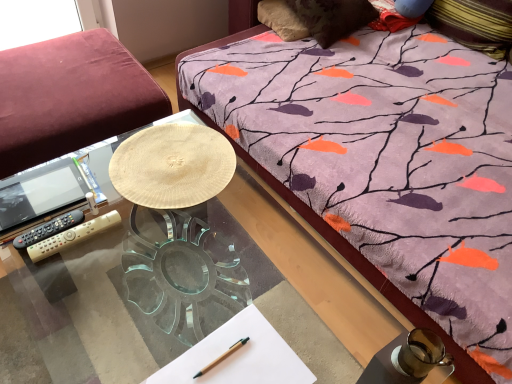
Question: Does velvet burgundy studio couch at left have a greater height compared to transparent glass desk at center?

Choices:
 (A) yes
 (B) no

Answer: (A)

Question: Are velvet burgundy studio couch at left and transparent glass desk at center far apart?

Choices:
 (A) no
 (B) yes

Answer: (A)

Question: Can you confirm if velvet burgundy studio couch at left is thinner than transparent glass desk at center?

Choices:
 (A) yes
 (B) no

Answer: (A)

Question: Considering the relative sizes of velvet burgundy studio couch at left and transparent glass desk at center in the image provided, is velvet burgundy studio couch at left shorter than transparent glass desk at center?

Choices:
 (A) yes
 (B) no

Answer: (B)

Question: Would you say velvet burgundy studio couch at left contains transparent glass desk at center?

Choices:
 (A) no
 (B) yes

Answer: (A)

Question: Relative to black plastic remote control at left, acting as the first remote control starting from the left, is wooden pen at lower center in front or behind?

Choices:
 (A) behind
 (B) front

Answer: (B)

Question: Is point (202, 372) positioned closer to the camera than point (49, 223)?

Choices:
 (A) closer
 (B) farther

Answer: (A)

Question: Looking at their shapes, would you say wooden pen at lower center is wider or thinner than black plastic remote control at left, acting as the first remote control starting from the left?

Choices:
 (A) thin
 (B) wide

Answer: (A)

Question: Looking at the image, does wooden pen at lower center seem bigger or smaller compared to black plastic remote control at left, acting as the first remote control starting from the left?

Choices:
 (A) small
 (B) big

Answer: (A)

Question: In terms of height, does transparent glass desk at center look taller or shorter compared to gold plastic remote control at lower left, placed as the 2th remote control when sorted from left to right?

Choices:
 (A) short
 (B) tall

Answer: (B)

Question: In the image, is transparent glass desk at center on the left side or the right side of gold plastic remote control at lower left, acting as the first remote control starting from the right?

Choices:
 (A) right
 (B) left

Answer: (A)

Question: Based on their sizes in the image, would you say transparent glass desk at center is bigger or smaller than gold plastic remote control at lower left, acting as the first remote control starting from the right?

Choices:
 (A) small
 (B) big

Answer: (B)

Question: Relative to gold plastic remote control at lower left, placed as the 2th remote control when sorted from left to right, is transparent glass desk at center in front or behind?

Choices:
 (A) front
 (B) behind

Answer: (A)

Question: In the image, is white paper at center on the left side or the right side of velvet burgundy studio couch at left?

Choices:
 (A) right
 (B) left

Answer: (A)

Question: Considering the positions of white paper at center and velvet burgundy studio couch at left in the image, is white paper at center taller or shorter than velvet burgundy studio couch at left?

Choices:
 (A) short
 (B) tall

Answer: (A)